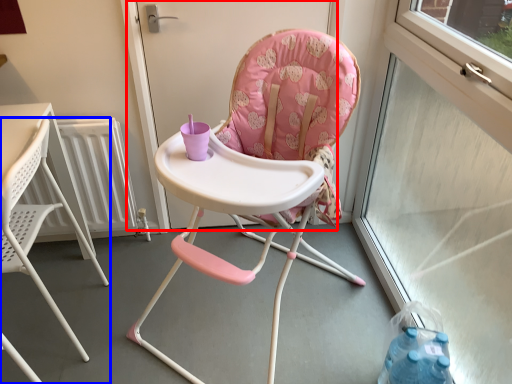
Question: Among these objects, which one is nearest to the camera, screen door (highlighted by a red box) or chair (highlighted by a blue box)?

Choices:
 (A) screen door
 (B) chair

Answer: (B)